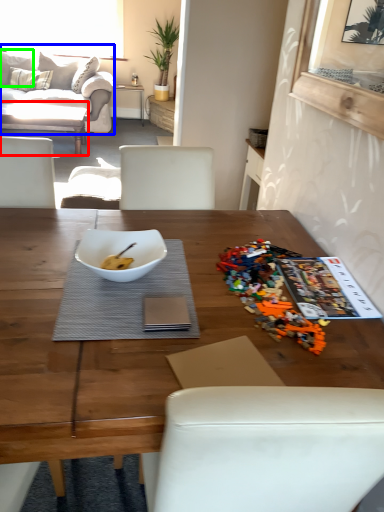
Question: Which object is the farthest from coffee table (highlighted by a red box)? Choose among these: studio couch (highlighted by a blue box) or pillow (highlighted by a green box).

Choices:
 (A) studio couch
 (B) pillow

Answer: (B)